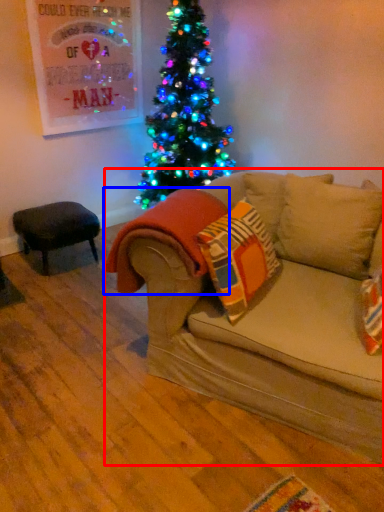
Question: Among these objects, which one is farthest to the camera, studio couch (highlighted by a red box) or blanket (highlighted by a blue box)?

Choices:
 (A) studio couch
 (B) blanket

Answer: (B)